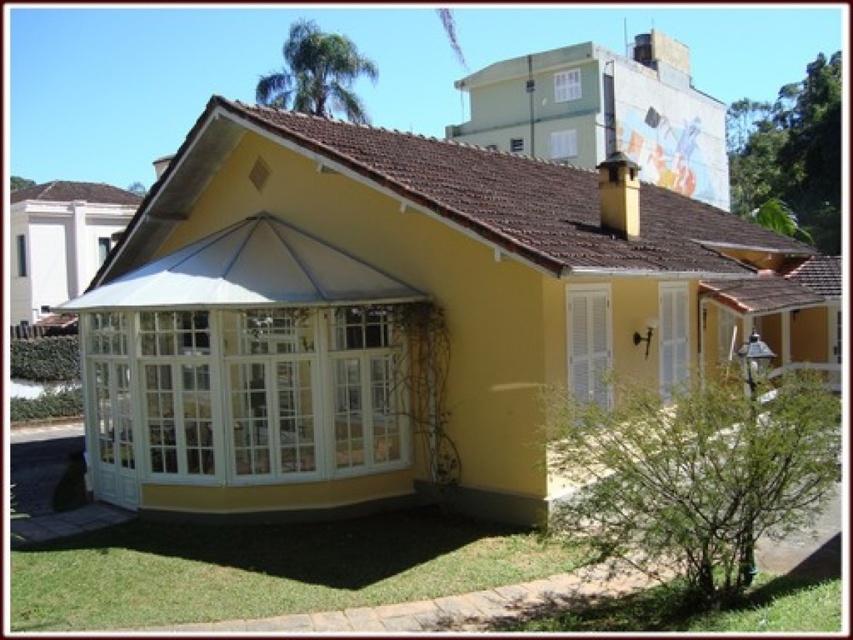
You are planning to install a new solar panel system on the roof of the house. The solar panels require a minimum height of 2 meters to be installed safely. Given that both the white glass conservatory at center and the white glass gazebo at center are located on the roof, which structure would be more suitable for installing the solar panels based on their height?

The white glass conservatory at center has a greater height compared to the white glass gazebo at center, so the solar panels should be installed on the white glass conservatory at center as it meets the minimum height requirement of 2 meters.